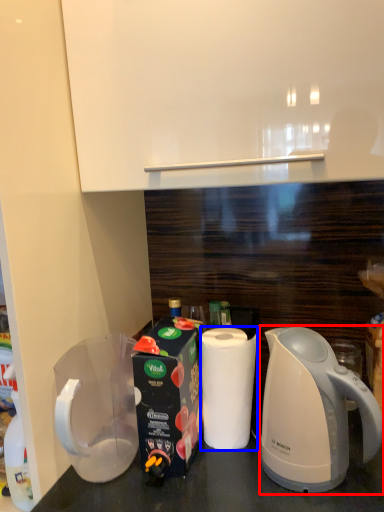
Question: Which of the following is the farthest to the observer, kettle (highlighted by a red box) or paper towel (highlighted by a blue box)?

Choices:
 (A) kettle
 (B) paper towel

Answer: (B)